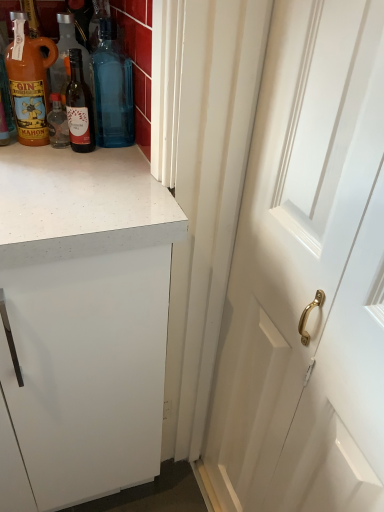
Question: Is matte glass bottle at upper center, which is the 2th bottle in left-to-right order, shorter than white wooden door at right?

Choices:
 (A) no
 (B) yes

Answer: (B)

Question: Is white wooden door at right at the back of matte glass bottle at upper center, marked as the second bottle in a right-to-left arrangement?

Choices:
 (A) no
 (B) yes

Answer: (A)

Question: Is matte glass bottle at upper center, marked as the second bottle in a right-to-left arrangement, wider than white wooden door at right?

Choices:
 (A) yes
 (B) no

Answer: (B)

Question: Is matte glass bottle at upper center, which is the 2th bottle in left-to-right order, outside of white wooden door at right?

Choices:
 (A) no
 (B) yes

Answer: (B)

Question: Does matte glass bottle at upper center, marked as the second bottle in a right-to-left arrangement, touch white wooden door at right?

Choices:
 (A) yes
 (B) no

Answer: (B)

Question: Considering the relative positions of white wooden door at right and matte orange bottle at left, the 1th bottle when ordered from left to right, in the image provided, is white wooden door at right to the left or to the right of matte orange bottle at left, the 1th bottle when ordered from left to right,?

Choices:
 (A) left
 (B) right

Answer: (B)

Question: From their relative heights in the image, would you say white wooden door at right is taller or shorter than matte orange bottle at left, the 1th bottle when ordered from left to right?

Choices:
 (A) short
 (B) tall

Answer: (B)

Question: In the image, is white wooden door at right positioned in front of or behind matte orange bottle at left, the third bottle in the right-to-left sequence?

Choices:
 (A) behind
 (B) front

Answer: (B)

Question: Does point (312, 32) appear closer or farther from the camera than point (31, 42)?

Choices:
 (A) closer
 (B) farther

Answer: (A)

Question: From a real-world perspective, is matte glass bottle at upper center, marked as the second bottle in a right-to-left arrangement, physically located above or below matte orange bottle at left, the third bottle in the right-to-left sequence?

Choices:
 (A) below
 (B) above

Answer: (A)

Question: Is point (92, 140) positioned closer to the camera than point (38, 51)?

Choices:
 (A) closer
 (B) farther

Answer: (B)

Question: Is matte glass bottle at upper center, which is the 2th bottle in left-to-right order, inside or outside of matte orange bottle at left, the third bottle in the right-to-left sequence?

Choices:
 (A) outside
 (B) inside

Answer: (A)

Question: In the image, is matte glass bottle at upper center, which is the 2th bottle in left-to-right order, positioned in front of or behind matte orange bottle at left, the third bottle in the right-to-left sequence?

Choices:
 (A) behind
 (B) front

Answer: (A)

Question: Would you say blue glass bottle at upper center, which ranks as the first bottle in right-to-left order, is to the left or to the right of white wooden door at right in the picture?

Choices:
 (A) right
 (B) left

Answer: (B)

Question: From a real-world perspective, is blue glass bottle at upper center, which is counted as the 3th bottle, starting from the left, physically located above or below white wooden door at right?

Choices:
 (A) above
 (B) below

Answer: (A)